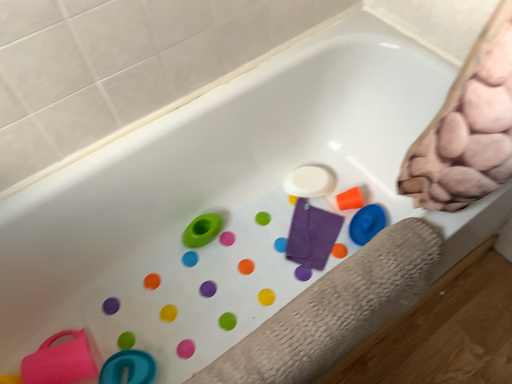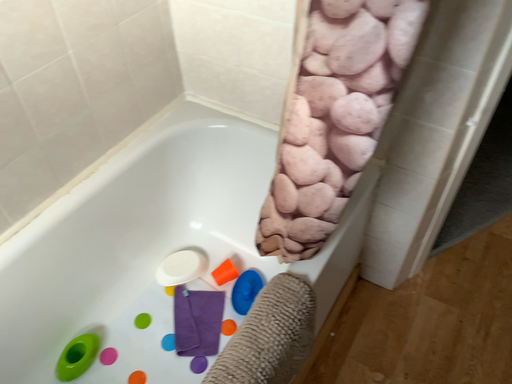
Question: How did the camera likely rotate when shooting the video?

Choices:
 (A) rotated right
 (B) rotated left

Answer: (A)